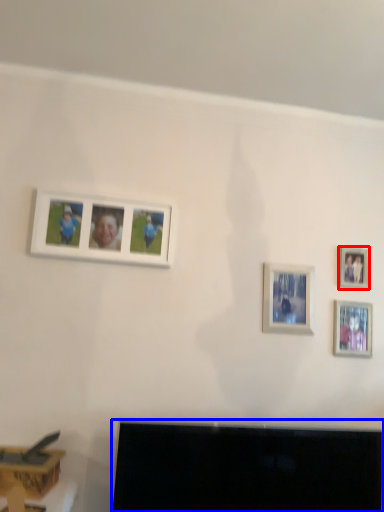
Question: Which object is further to the camera taking this photo, picture frame (highlighted by a red box) or television (highlighted by a blue box)?

Choices:
 (A) picture frame
 (B) television

Answer: (A)